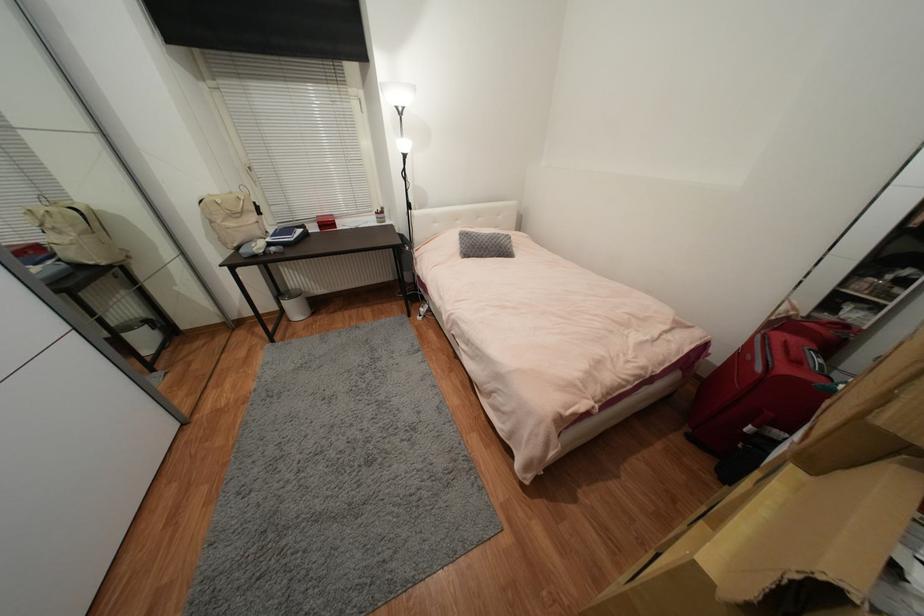
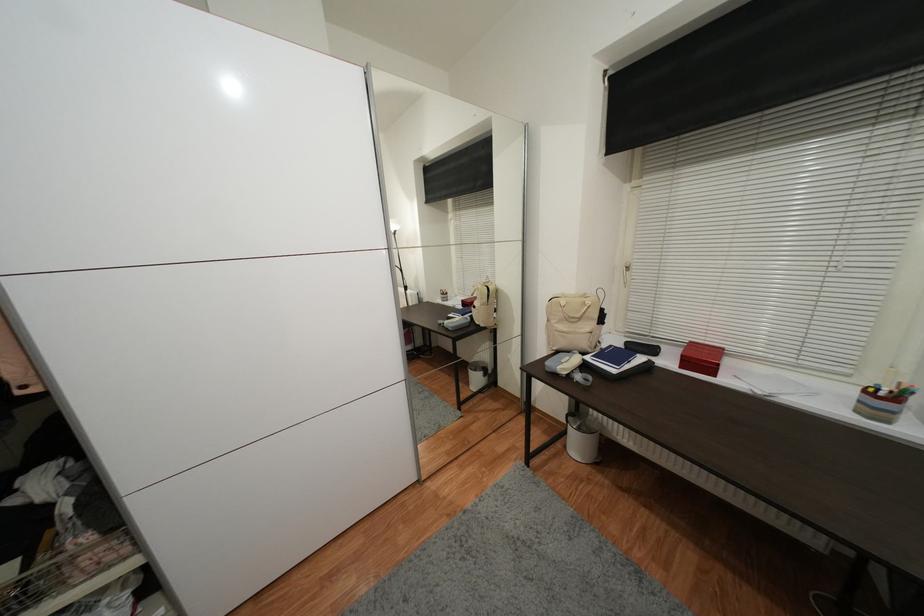
Question: I am providing you with two images of the same scene from different viewpoints. Which of the following objects are not visible in image2?

Choices:
 (A) white window handle
 (B) striped pencil holder
 (C) blinds pull chain
 (D) none of these

Answer: (D)